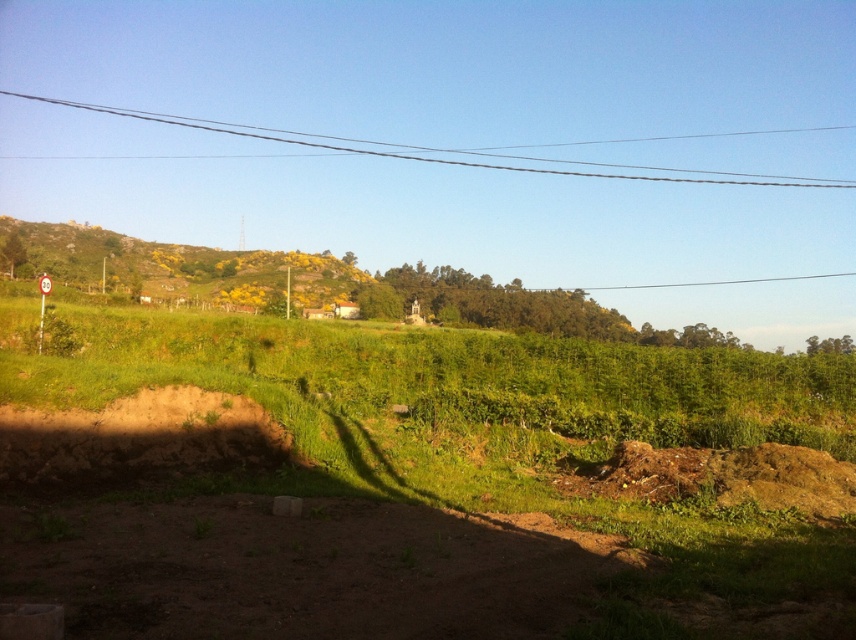
Question: Which of the following is the farthest from the observer?

Choices:
 (A) (70, 225)
 (B) (415, 336)

Answer: (A)

Question: Which object is farther from the camera taking this photo?

Choices:
 (A) green grassy at center
 (B) green grassy hillside at upper left
 (C) brown dirt track at lower center
 (D) clear wire at upper center

Answer: (D)

Question: Does green grassy at center appear on the left side of clear wire at upper center?

Choices:
 (A) no
 (B) yes

Answer: (A)

Question: Does green grassy at center come behind green grassy hillside at upper left?

Choices:
 (A) yes
 (B) no

Answer: (B)

Question: Does green grassy at center come behind clear wire at upper center?

Choices:
 (A) no
 (B) yes

Answer: (A)

Question: Based on their relative distances, which object is nearer to the green grassy at center?

Choices:
 (A) clear wire at upper center
 (B) brown dirt track at lower center

Answer: (B)